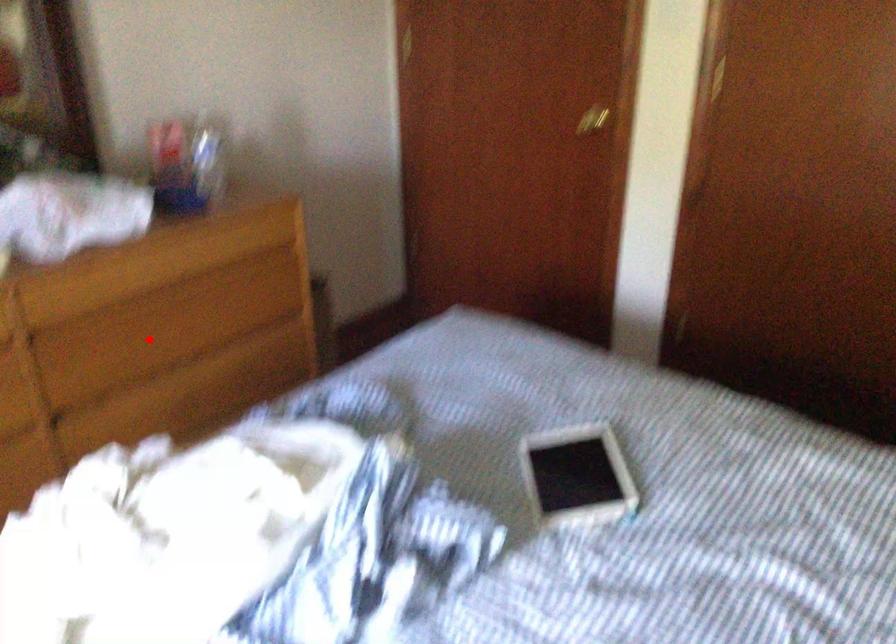
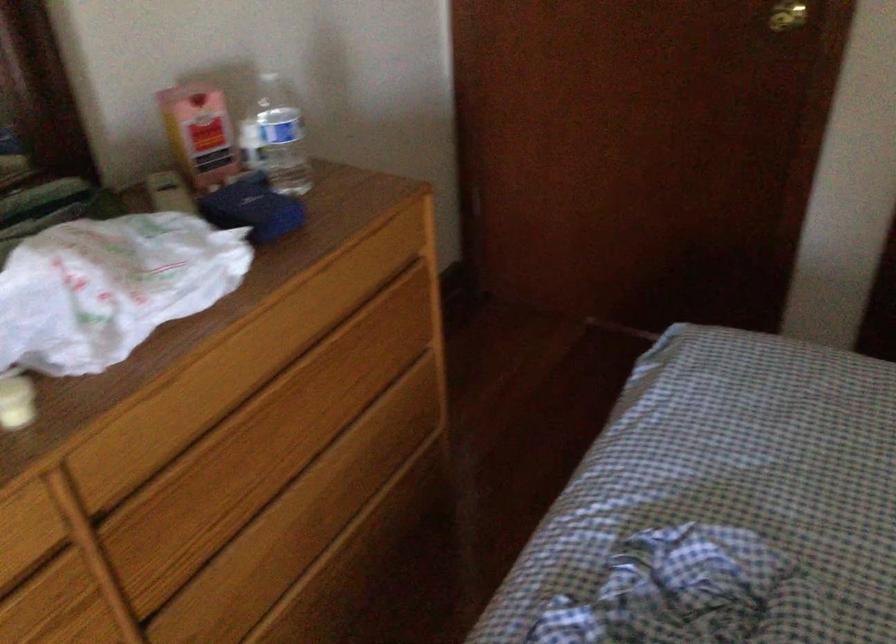
The point at the highlighted location is marked in the first image. Where is the corresponding point in the second image?

(263, 456)